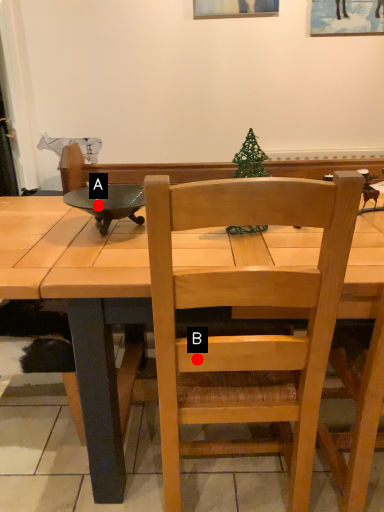
Question: Two points are circled on the image, labeled by A and B beside each circle. Which point is farther from the camera taking this photo?

Choices:
 (A) A is further
 (B) B is further

Answer: (A)